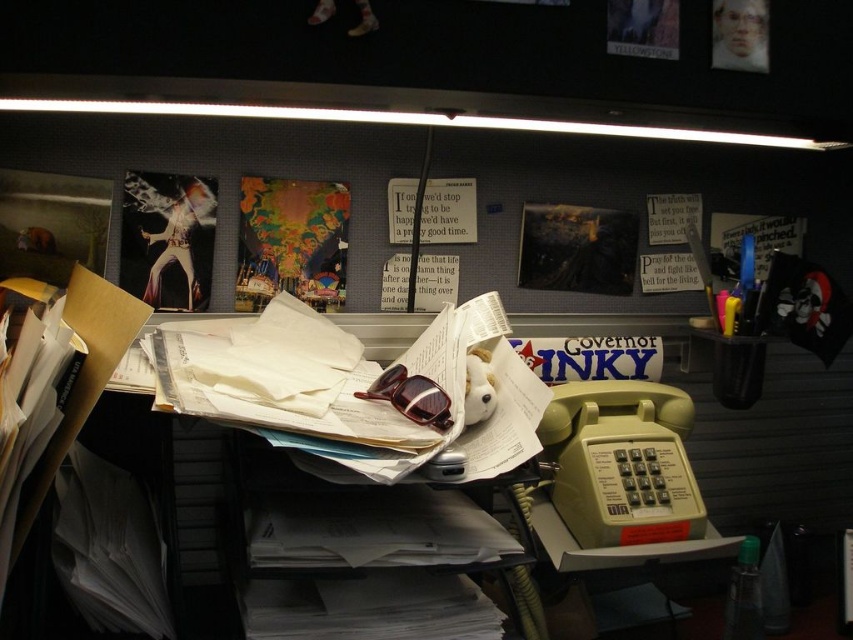
You are organizing the desk and need to place a new item between the beige plastic telephone at lower right and the matte paper poster at center. Based on their positions, which object should the new item be closer to?

The beige plastic telephone at lower right is to the right of the matte paper poster at center, so the new item should be placed closer to the matte paper poster at center to maintain the left to right order.

You are organizing the desk and need to place a new item between the beige plastic telephone at right and the matte paper poster at center. Is there enough vertical space between them to fit a 10 cm tall object?

The beige plastic telephone at right is located below the matte paper poster at center, but the exact vertical distance between them isn

In the scene shown: You are an office worker who needs to hang a new poster that is the same size as the shiny silver poster at upper left. You have a space on the wall next to the beige plastic telephone at lower right. Will the space be big enough for the new poster?

The shiny silver poster at upper left is smaller than the beige plastic telephone at lower right. Since the new poster is the same size as the shiny silver poster at upper left, the space next to the beige plastic telephone at lower right should be sufficient as it can accommodate the smaller size.